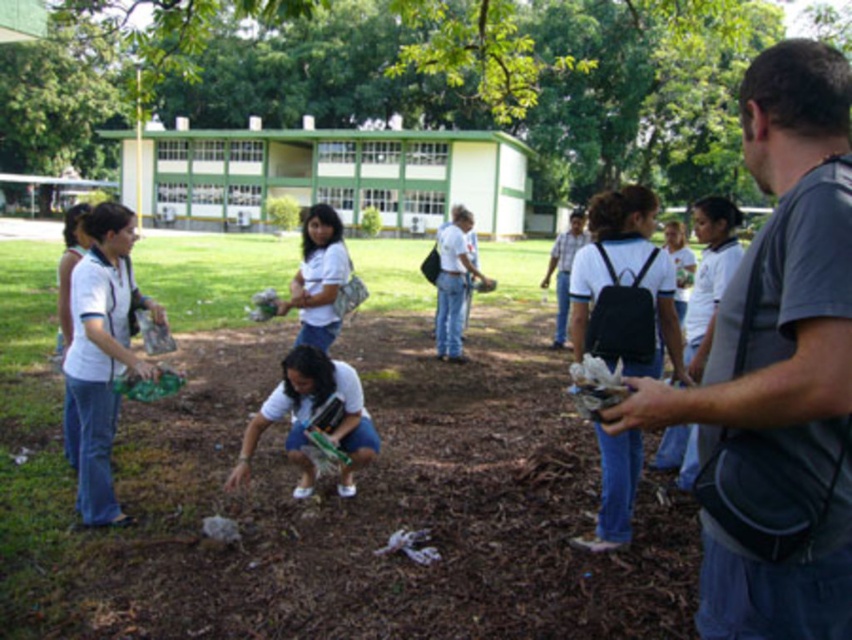
You are standing at the center of the image and want to place a new trash bin. Where should you position it so that it is closest to the gray fabric bag at center right without overlapping it?

The gray fabric bag at center right is located at coordinates [780,355]. To place the trash bin closest to it without overlapping, position it near those coordinates but slightly offset to ensure there is space between them.

You are organizing a community cleanup and need to distribute supplies. You have a gray fabric bag at center right and a white shirt at center. Which item is smaller in size?

The gray fabric bag at center right has a smaller size compared to the white shirt at center.

You are a participant in the cleanup activity and need to decide which item is narrower between the gray fabric bag at center right and the white shirt at center. Which one is it?

The gray fabric bag at center right is thinner than the white shirt at center, so the gray fabric bag at center right is narrower.